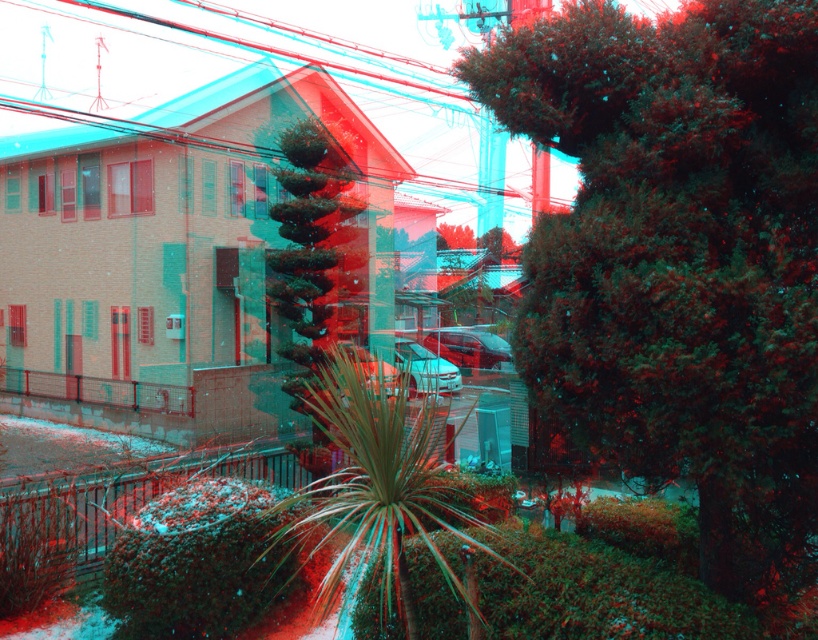
You are standing in the garden and want to place a small snowman exactly where the green textured bush at center is located. Is this possible?

The green textured bush at center is located at point 2D coordinates (x=679, y=260), so no, you cannot place the snowman there because the bush is already occupying that spot.

In the scene shown: You are standing in the snow covered garden and see the green leafy plant at center and the green textured plant at center. Which one is closer to the ground?

The green leafy plant at center is closer to the ground because it is below the green textured plant at center.

You are standing in a snowy garden and see both the green leafy plant at center and the green textured plant at center. Which one is taller?

The green leafy plant at center is taller than the green textured plant at center.